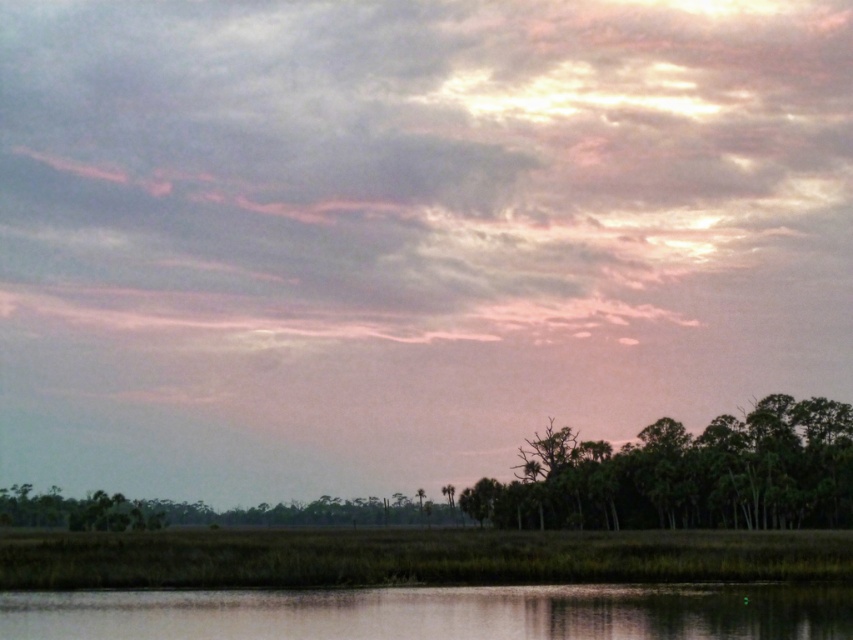
Does smooth water at bottom appear over green leafy trees at lower right?

Yes, smooth water at bottom is above green leafy trees at lower right.

Does point (196, 632) come closer to viewer compared to point (558, 522)?

That is True.

Locate an element on the screen. The height and width of the screenshot is (640, 853). smooth water at bottom is located at coordinates (437, 612).